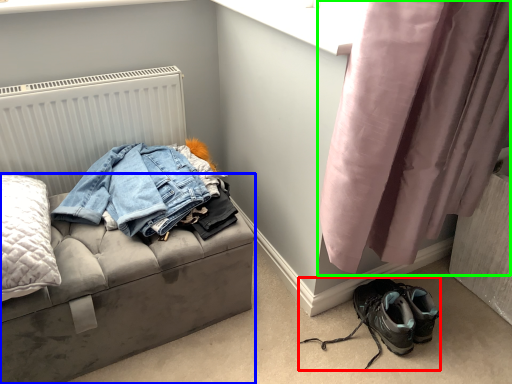
Question: Estimate the real-world distances between objects in this image. Which object is closer to footwear (highlighted by a red box), furniture (highlighted by a blue box) or curtain (highlighted by a green box)?

Choices:
 (A) furniture
 (B) curtain

Answer: (B)